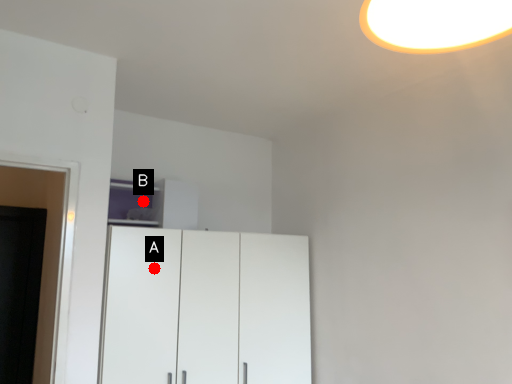
Question: Two points are circled on the image, labeled by A and B beside each circle. Among these points, which one is nearest to the camera?

Choices:
 (A) A is closer
 (B) B is closer

Answer: (A)